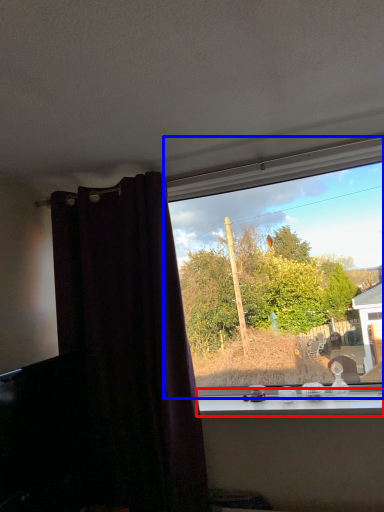
Question: Which point is closer to the camera, window sill (highlighted by a red box) or window (highlighted by a blue box)?

Choices:
 (A) window sill
 (B) window

Answer: (A)